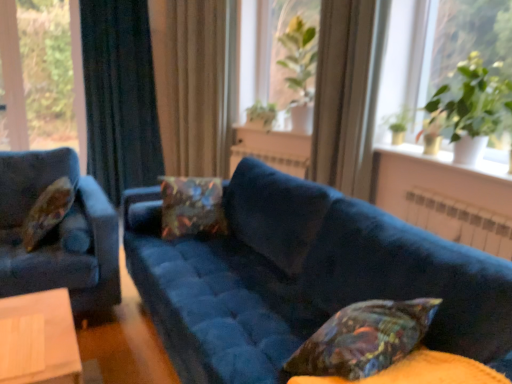
Question: Does green leafy plant at upper right have a smaller size compared to dark blue velvet curtain at left, the first curtain in the left-to-right sequence?

Choices:
 (A) yes
 (B) no

Answer: (A)

Question: From a real-world perspective, is green leafy plant at upper right beneath dark blue velvet curtain at left, the first curtain in the left-to-right sequence?

Choices:
 (A) yes
 (B) no

Answer: (B)

Question: Can you confirm if green leafy plant at upper right is wider than dark blue velvet curtain at left, the 2th curtain in the right-to-left sequence?

Choices:
 (A) yes
 (B) no

Answer: (B)

Question: Is green leafy plant at upper right thinner than dark blue velvet curtain at left, the 2th curtain in the right-to-left sequence?

Choices:
 (A) no
 (B) yes

Answer: (B)

Question: Does green leafy plant at upper right have a lesser height compared to dark blue velvet curtain at left, the first curtain in the left-to-right sequence?

Choices:
 (A) no
 (B) yes

Answer: (B)

Question: Does green leafy plant at upper right have a larger size compared to dark blue velvet curtain at left, the first curtain in the left-to-right sequence?

Choices:
 (A) no
 (B) yes

Answer: (A)

Question: Is dark blue velvet curtain at left, the 2th curtain in the right-to-left sequence, surrounded by white ceramic vase at upper right?

Choices:
 (A) yes
 (B) no

Answer: (B)

Question: From the image's perspective, is white ceramic vase at upper right located above dark blue velvet curtain at left, the first curtain in the left-to-right sequence?

Choices:
 (A) no
 (B) yes

Answer: (A)

Question: Is white ceramic vase at upper right aimed at dark blue velvet curtain at left, the 2th curtain in the right-to-left sequence?

Choices:
 (A) yes
 (B) no

Answer: (B)

Question: Are white ceramic vase at upper right and dark blue velvet curtain at left, the first curtain in the left-to-right sequence, making contact?

Choices:
 (A) no
 (B) yes

Answer: (A)

Question: Does white ceramic vase at upper right have a greater width compared to dark blue velvet curtain at left, the 2th curtain in the right-to-left sequence?

Choices:
 (A) no
 (B) yes

Answer: (B)

Question: Considering the relative positions of white ceramic vase at upper right and dark blue velvet curtain at left, the 2th curtain in the right-to-left sequence, in the image provided, is white ceramic vase at upper right behind dark blue velvet curtain at left, the 2th curtain in the right-to-left sequence,?

Choices:
 (A) yes
 (B) no

Answer: (B)

Question: Is green leafy plant at upper right in contact with green leafy plant at center, the 3th plant viewed from the back?

Choices:
 (A) yes
 (B) no

Answer: (B)